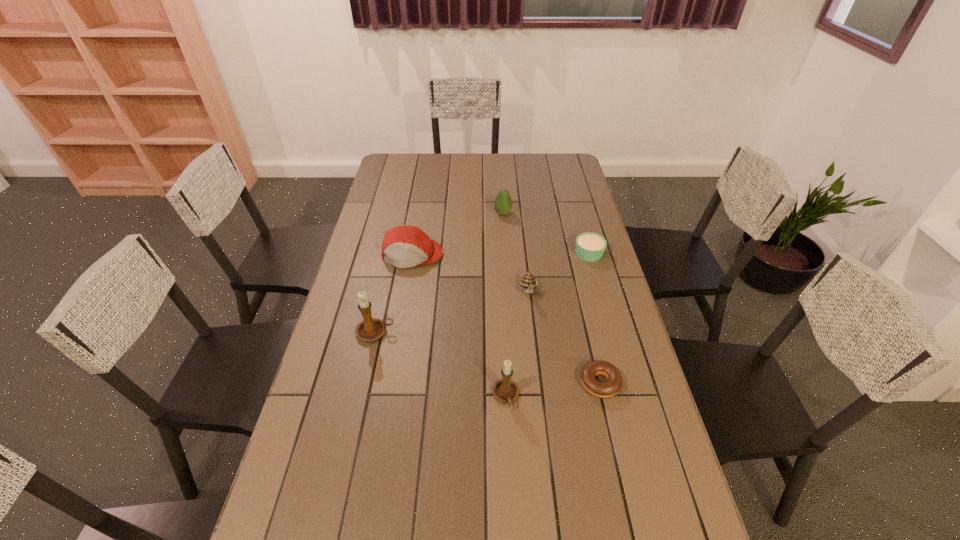
The height and width of the screenshot is (540, 960). I want to click on free location located 0.320m on the side of the left candle holder with the handle, so click(499, 332).

Find the location of `blank space located 0.210m on the side of the shorter candle holder with the handle`. blank space located 0.210m on the side of the shorter candle holder with the handle is located at coordinates (511, 495).

Identify the location of vacant space located on the back of the avocado. This screenshot has width=960, height=540. (502, 200).

The height and width of the screenshot is (540, 960). I want to click on vacant space located on the face of the fourth farthest object, so click(x=538, y=372).

Locate an element on the screen. Image resolution: width=960 pixels, height=540 pixels. free region located 0.070m on the front-facing side of the cap is located at coordinates (407, 285).

The image size is (960, 540). I want to click on blank space located 0.060m on the front of the second shortest object, so click(595, 275).

Locate an element on the screen. Image resolution: width=960 pixels, height=540 pixels. free space located 0.360m on the back of the doughnut is located at coordinates (576, 280).

Identify the location of candle holder that is at the left edge. (370, 329).

This screenshot has width=960, height=540. In order to click on cap located at the left edge in this screenshot , I will do `click(404, 246)`.

Where is `cupcake situated at the right edge`? The height and width of the screenshot is (540, 960). cupcake situated at the right edge is located at coordinates (590, 247).